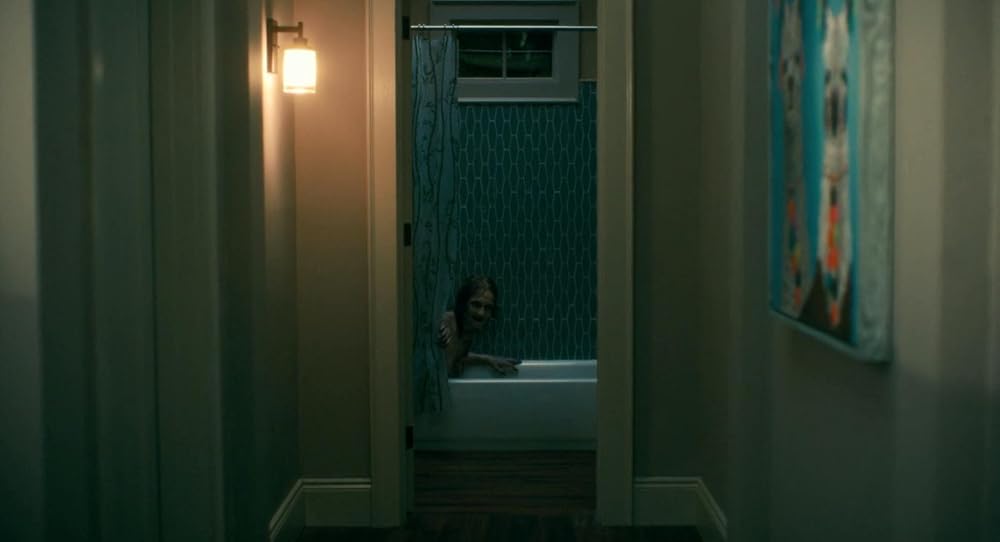
This screenshot has width=1000, height=542. What are the coordinates of `grey picture frame` in the screenshot? It's located at (874, 141).